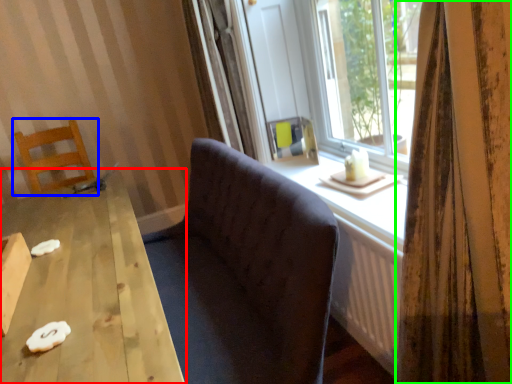
Question: Which object is the farthest from table (highlighted by a red box)? Choose among these: chair (highlighted by a blue box) or curtain (highlighted by a green box).

Choices:
 (A) chair
 (B) curtain

Answer: (A)